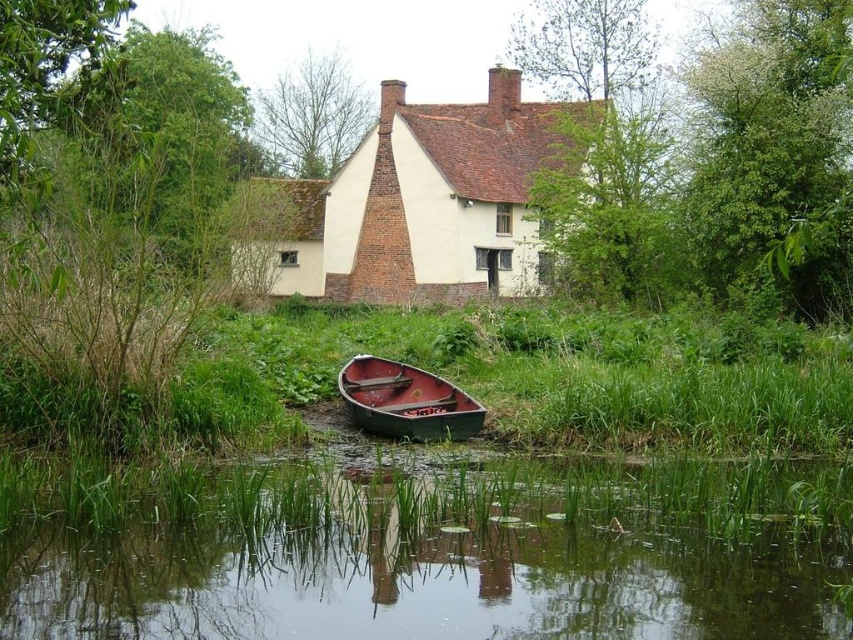
You are standing at the edge of the green grassy river at lower center and the green grassy at lower center. Which one is closer to your feet?

The green grassy river at lower center is positioned under green grassy at lower center, so the green grassy at lower center is closer to your feet.